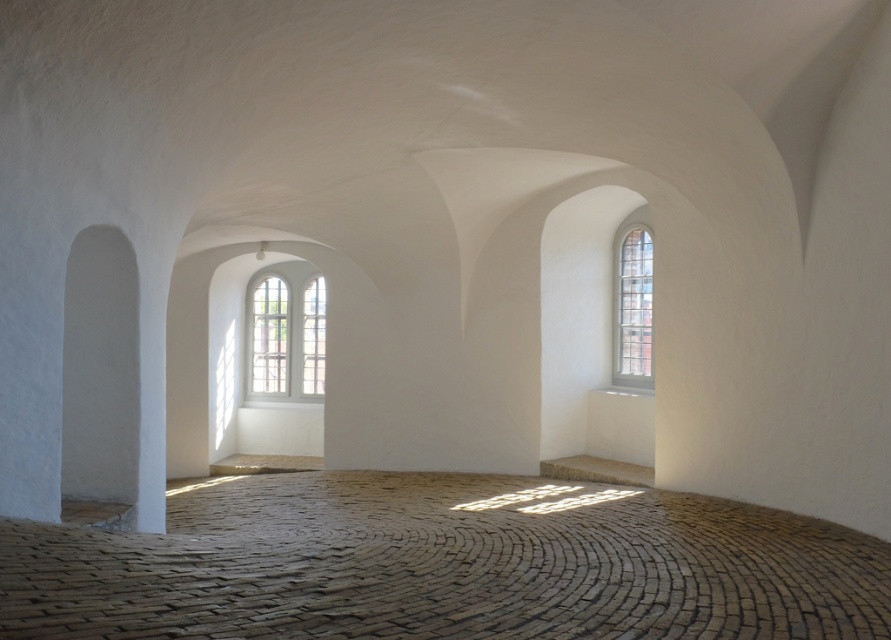
You are an interior designer planning to install a new piece of artwork. You have two options for placement between the white wooden window at center and the clear glass window at right. Which window has a larger space available for the artwork?

The white wooden window at center has a larger space available for artwork because its width surpasses that of the clear glass window at right.